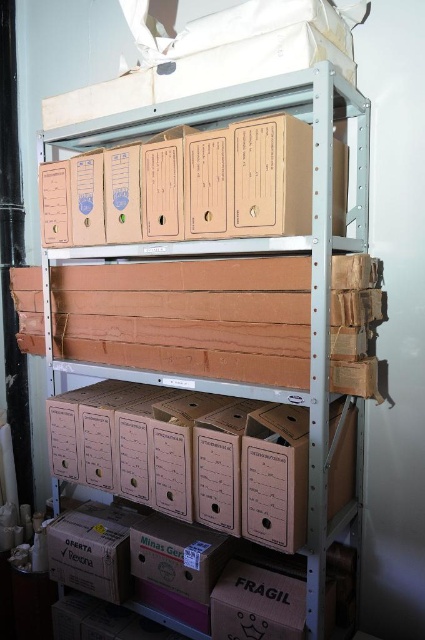
Who is taller, cardboard box at center or brown cardboard boxes at center?

brown cardboard boxes at center is taller.

Does cardboard box at center have a smaller size compared to brown cardboard boxes at center?

Correct, cardboard box at center occupies less space than brown cardboard boxes at center.

Which is in front, point (113, 417) or point (319, 556)?

Point (319, 556)

Where is `cardboard box at center`? The image size is (425, 640). cardboard box at center is located at coordinates (189, 456).